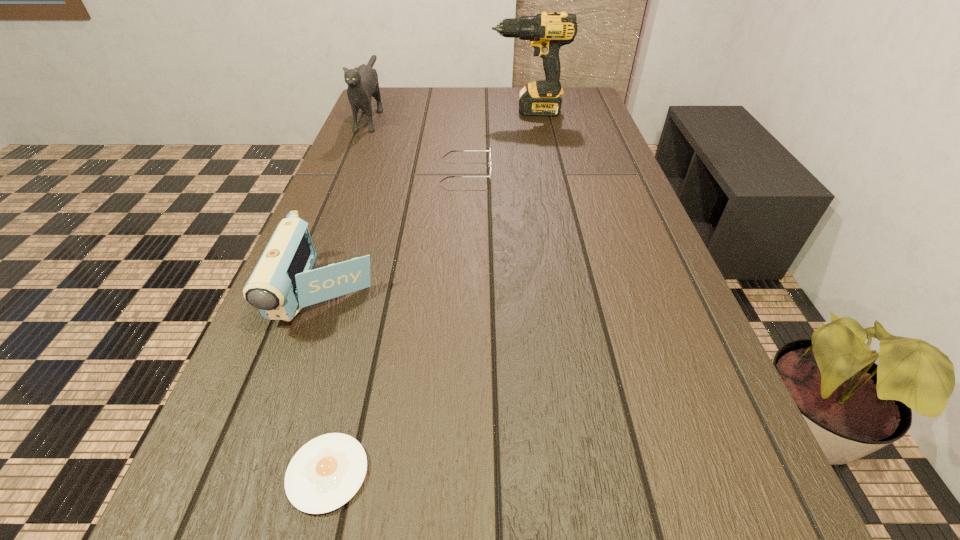
At what (x,y) coordinates should I click in order to perform the action: click on free point between the cat and the drill. Please return your answer as a coordinate pair (x, y). Looking at the image, I should click on (449, 112).

The width and height of the screenshot is (960, 540). What are the coordinates of `vacant space in between the second object from right to left and the shortest object` in the screenshot? It's located at (x=397, y=322).

Locate an element on the screen. The image size is (960, 540). free space between the spectacles and the camcorder is located at coordinates click(x=396, y=233).

Find the location of a particular element. The image size is (960, 540). vacant area that lies between the tallest object and the second tallest object is located at coordinates (449, 112).

Identify the location of free point between the fourth shortest object and the second nearest object. The image size is (960, 540). (349, 203).

Find the location of a particular element. This screenshot has width=960, height=540. object that is the third nearest to the drill is located at coordinates (283, 282).

Identify which object is located as the second nearest to the second tallest object. Please provide its 2D coordinates. Your answer should be formatted as a tuple, i.e. [(x, y)], where the tuple contains the x and y coordinates of a point satisfying the conditions above.

[(547, 32)]

Identify the location of vacant space that satisfies the following two spatial constraints: 1. on the side of the shortest object with the flip-out screen; 2. on the left side of the camcorder. This screenshot has height=540, width=960. (265, 473).

Where is `vacant area that satisfies the following two spatial constraints: 1. on the side of the camcorder with the flip-out screen; 2. on the right side of the nearest object`? This screenshot has height=540, width=960. vacant area that satisfies the following two spatial constraints: 1. on the side of the camcorder with the flip-out screen; 2. on the right side of the nearest object is located at coordinates (265, 473).

The height and width of the screenshot is (540, 960). In order to click on free space that satisfies the following two spatial constraints: 1. at the tip of the tallest object; 2. on the front-facing side of the cat in this screenshot , I will do `click(528, 113)`.